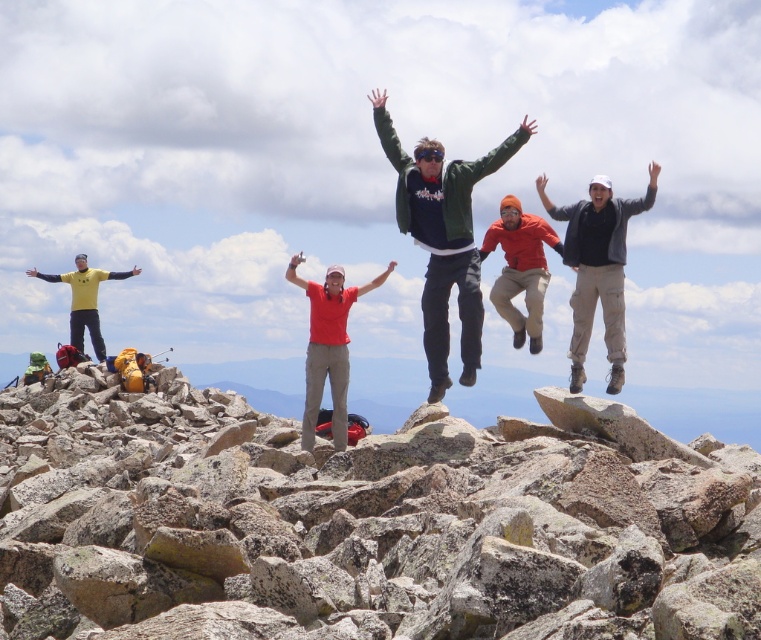
Question: Observing the image, what is the correct spatial positioning of gray speckled rock at center in reference to green matte jacket at center?

Choices:
 (A) below
 (B) above

Answer: (A)

Question: From the image, what is the correct spatial relationship of green matte jacket at center in relation to orange fabric jacket at center?

Choices:
 (A) right
 (B) left

Answer: (B)

Question: Which object is the closest to the orange fabric jacket at center?

Choices:
 (A) yellow matte shirt at left
 (B) green matte jacket at center

Answer: (B)

Question: Considering the real-world distances, which object is closest to the yellow matte shirt at left?

Choices:
 (A) gray speckled rock at center
 (B) orange fabric jacket at center
 (C) green matte jacket at center
 (D) matte black jacket at center

Answer: (A)

Question: Observing the image, what is the correct spatial positioning of gray speckled rock at center in reference to orange fabric jacket at center?

Choices:
 (A) left
 (B) right

Answer: (A)

Question: Estimate the real-world distances between objects in this image. Which object is farther from the green matte jacket at center?

Choices:
 (A) matte black jacket at center
 (B) orange fabric jacket at center

Answer: (A)